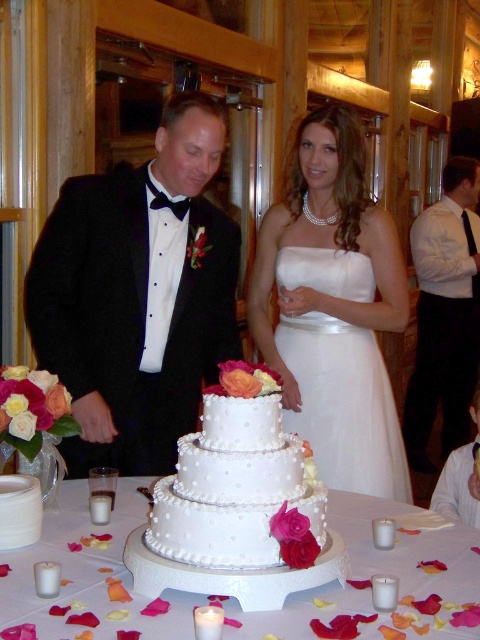
Does point (238, 468) come closer to viewer compared to point (412, 406)?

Yes, it is in front of point (412, 406).

Is white pearlized cake at center taller than white shirt at right?

Incorrect, white pearlized cake at center's height is not larger of white shirt at right's.

The height and width of the screenshot is (640, 480). What do you see at coordinates (237, 506) in the screenshot?
I see `white pearlized cake at center` at bounding box center [237, 506].

Image resolution: width=480 pixels, height=640 pixels. In order to click on white pearlized cake at center in this screenshot , I will do `click(237, 506)`.

Which of these two, black satin tuxedo at center or white shirt at right, stands taller?

white shirt at right is taller.

Is point (215, 218) less distant than point (410, 458)?

Yes, it is.

What are the coordinates of `black satin tuxedo at center` in the screenshot? It's located at (137, 296).

Is point (344, 564) in front of point (39, 621)?

That is False.

Is white pearlized cake at center thinner than white pearl cake at center?

Yes, white pearlized cake at center is thinner than white pearl cake at center.

From the picture: Who is more distant from viewer, (169, 518) or (26, 589)?

The point (169, 518) is behind.

Identify the location of white pearlized cake at center. (237, 506).